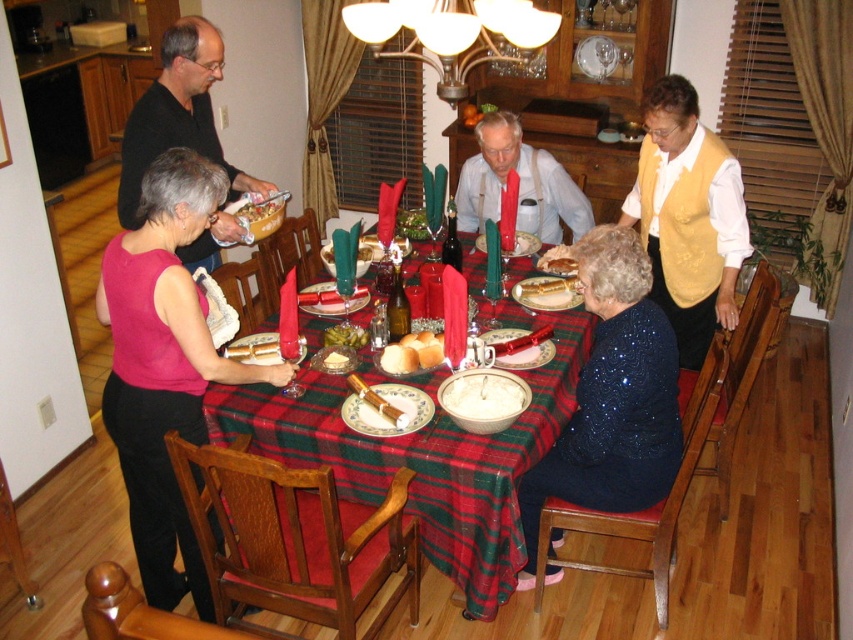
You are a guest at the family gathering and want to place your coat on the chair closest to you. There are two chairs at coordinates point (448, 451) and point (351, 324). Which chair should you choose?

You should choose the chair at point (448, 451) because it is closer to you than the chair at point (351, 324).

You are a photographer setting up for a family photo. You need to position yourself so that both the sparkly blue dress at lower center and the matte white shirt at center are fully visible in the frame. Based on their positions, which object is closer to the camera and might block the view of the other?

The sparkly blue dress at lower center is in front of the matte white shirt at center, so it is closer to the camera and could potentially block the view of the matte white shirt at center.

You are a photographer setting up for a family photo. You need to position a spotlight so it can illuminate both the sparkly blue dress at lower center and the matte white shirt at center without casting shadows. Considering their heights, which object should be placed closer to the spotlight to ensure even lighting?

The sparkly blue dress at lower center is much taller than the matte white shirt at center, so placing the spotlight closer to the sparkly blue dress at lower center will help ensure even lighting between both objects.